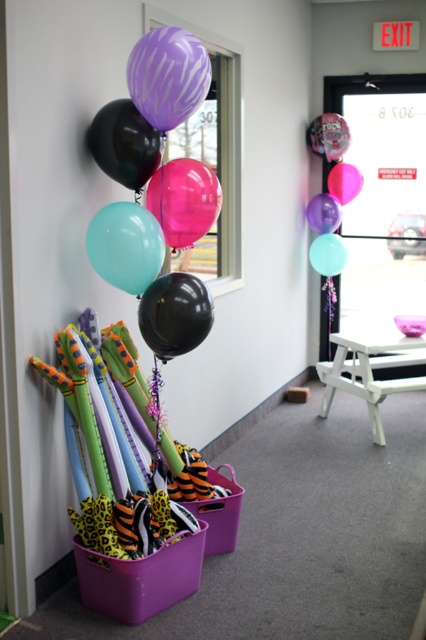
Can you confirm if translucent purple balloon at upper center is taller than pink glossy balloon at upper center?

Yes.

Between point (336, 224) and point (336, 170), which one is positioned in front?

Positioned in front is point (336, 170).

This screenshot has width=426, height=640. In order to click on translucent purple balloon at upper center in this screenshot , I will do `click(324, 212)`.

Which is more to the right, translucent glossy balloon at center or black matte balloon at left?

translucent glossy balloon at center

Is point (149, 182) farther from viewer compared to point (115, 152)?

Yes, it is behind point (115, 152).

You are a GUI agent. You are given a task and a screenshot of the screen. Output one action in this format:
    pyautogui.click(x=<x>, y=<y>)
    Task: Click on the translucent glossy balloon at center
    
    Given the screenshot: What is the action you would take?
    pyautogui.click(x=184, y=200)

Does point (350, 372) come farther from viewer compared to point (313, 257)?

That is True.

Can you confirm if white plastic stool at lower center is positioned to the left of matte teal balloon at center?

In fact, white plastic stool at lower center is to the right of matte teal balloon at center.

Is point (362, 340) closer to viewer compared to point (334, 253)?

Yes.

The width and height of the screenshot is (426, 640). I want to click on white plastic stool at lower center, so click(x=371, y=368).